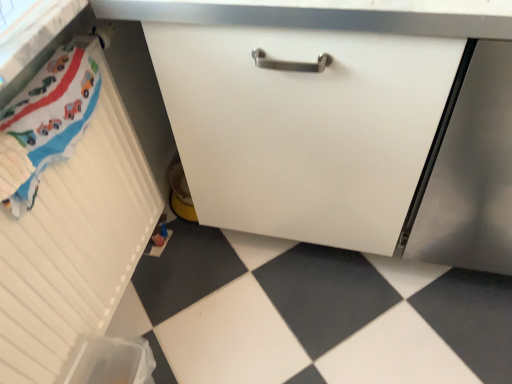
The height and width of the screenshot is (384, 512). I want to click on vacant area that lies between white matte cabinet at center, which appears as the 2th cabinetry when viewed from the left, and white matte radiator at left, the second cabinetry when ordered from right to left, so click(x=232, y=301).